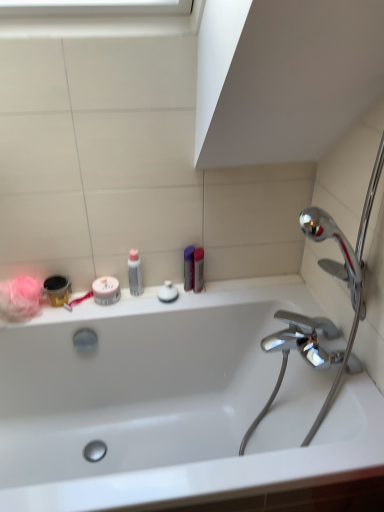
At what (x,y) coordinates should I click in order to perform the action: click on unoccupied region to the right of translucent plastic bottle at upper center, the 1th toiletry positioned from the left. Please return your answer as a coordinate pair (x, y). This screenshot has width=384, height=512. Looking at the image, I should click on (177, 302).